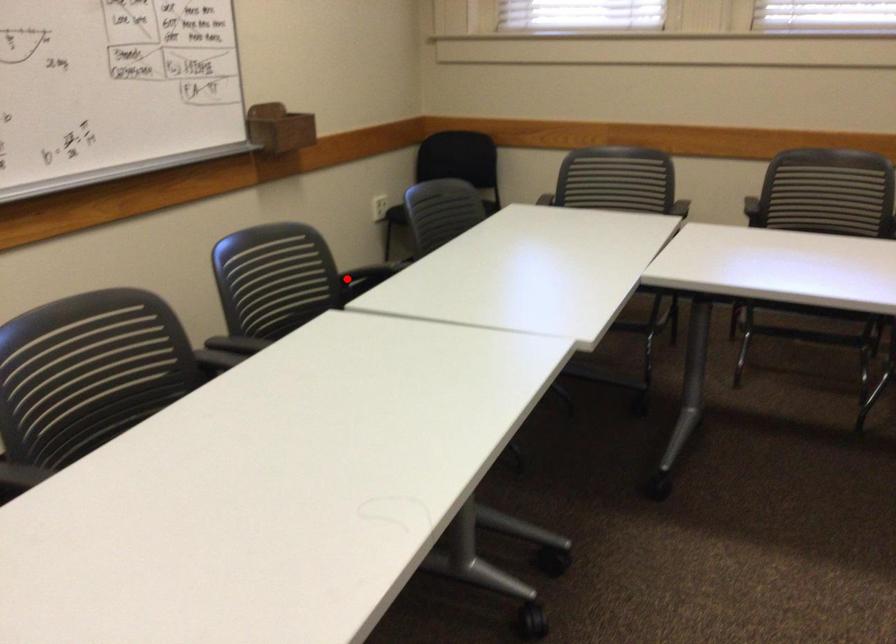
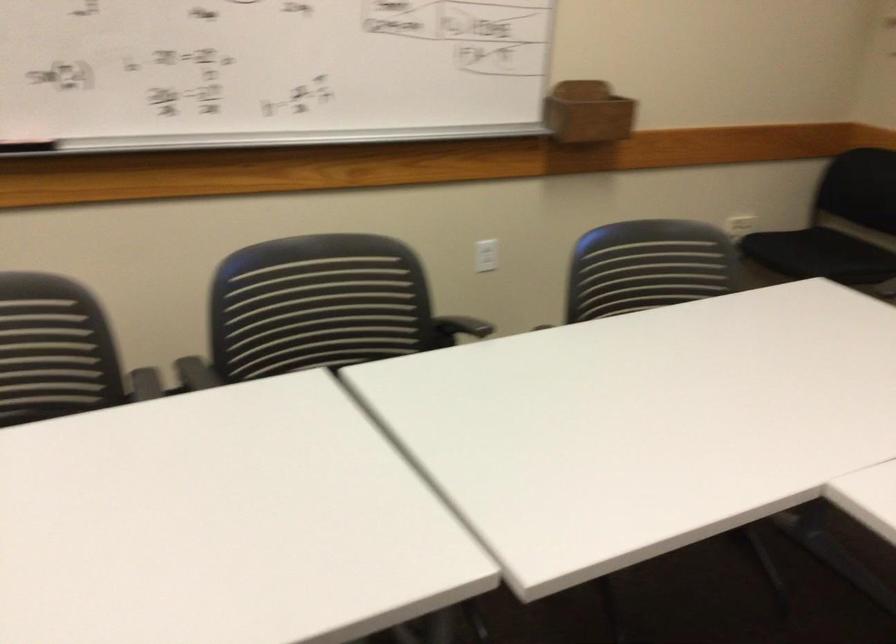
Find the pixel in the second image that matches the highlighted location in the first image.

(458, 328)